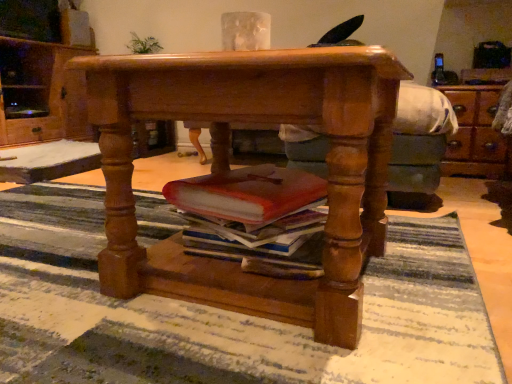
Question: From the image's perspective, is polished wood desk at center above or below wooden cabinet at left?

Choices:
 (A) below
 (B) above

Answer: (A)

Question: From a real-world perspective, is polished wood desk at center physically located above or below wooden cabinet at left?

Choices:
 (A) below
 (B) above

Answer: (A)

Question: Which of these objects is positioned closest to the striped rug at center?

Choices:
 (A) green leafy plant at upper left
 (B) wooden cabinet at left
 (C) polished wood desk at center

Answer: (C)

Question: Which of these objects is positioned closest to the striped rug at center?

Choices:
 (A) wooden cabinet at left
 (B) green leafy plant at upper left
 (C) polished wood desk at center

Answer: (C)